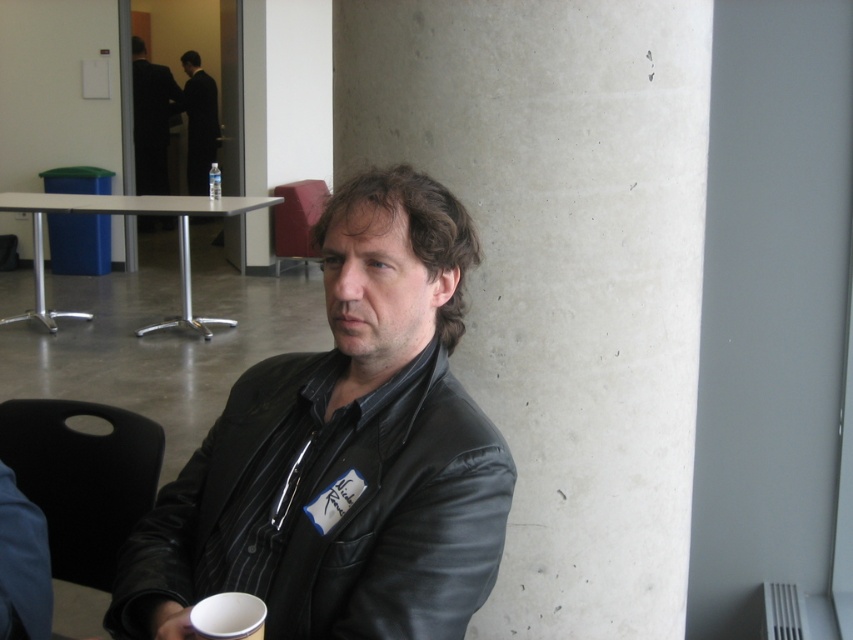
Is concrete pillar at center to the right of clear plastic bottle at center from the viewer's perspective?

Yes, concrete pillar at center is to the right of clear plastic bottle at center.

Which of these two, concrete pillar at center or clear plastic bottle at center, stands taller?

concrete pillar at center is taller.

Is point (515, 448) farther from viewer compared to point (216, 177)?

No, (515, 448) is closer to viewer.

You are a GUI agent. You are given a task and a screenshot of the screen. Output one action in this format:
    pyautogui.click(x=<x>, y=<y>)
    Task: Click on the concrete pillar at center
    Image resolution: width=853 pixels, height=640 pixels.
    Given the screenshot: What is the action you would take?
    pyautogui.click(x=561, y=272)

Is black leather jacket at center taller than dark suit at upper left?

In fact, black leather jacket at center may be shorter than dark suit at upper left.

Does black leather jacket at center have a larger size compared to dark suit at upper left?

Incorrect, black leather jacket at center is not larger than dark suit at upper left.

Who is more forward, (471, 552) or (138, 106)?

Positioned in front is point (471, 552).

The height and width of the screenshot is (640, 853). Find the location of `black leather jacket at center`. black leather jacket at center is located at coordinates (343, 452).

Does point (138, 90) come farther from viewer compared to point (212, 170)?

Yes.

Between point (135, 56) and point (218, 172), which one is positioned in front?

Point (218, 172)

The width and height of the screenshot is (853, 640). Identify the location of dark suit at upper left. (149, 120).

Identify the location of dark suit at upper left. This screenshot has width=853, height=640. (149, 120).